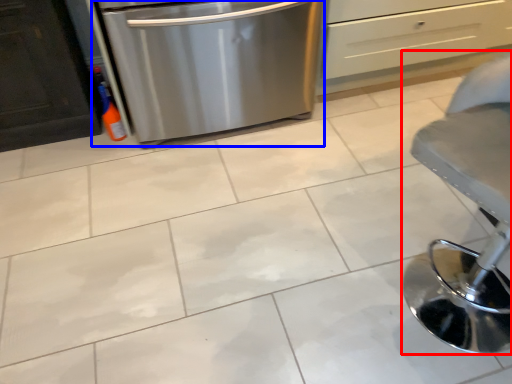
Question: Which object is closer to the camera taking this photo, furniture (highlighted by a red box) or home appliance (highlighted by a blue box)?

Choices:
 (A) furniture
 (B) home appliance

Answer: (A)